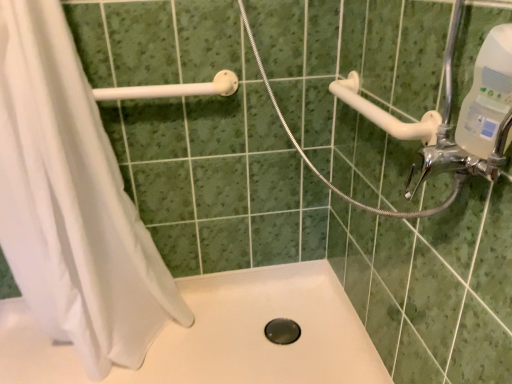
Question: Would you say white fabric shower curtain at left is outside white matte bath at center?

Choices:
 (A) no
 (B) yes

Answer: (B)

Question: Is white fabric shower curtain at left bigger than white matte bath at center?

Choices:
 (A) no
 (B) yes

Answer: (B)

Question: Can you confirm if white fabric shower curtain at left is positioned to the left of white matte bath at center?

Choices:
 (A) no
 (B) yes

Answer: (B)

Question: Is white matte bath at center inside white fabric shower curtain at left?

Choices:
 (A) no
 (B) yes

Answer: (A)

Question: Is white fabric shower curtain at left positioned with its back to white matte bath at center?

Choices:
 (A) no
 (B) yes

Answer: (A)

Question: In terms of width, does black rubber hole at center look wider or thinner when compared to chrome metallic faucet at upper right?

Choices:
 (A) wide
 (B) thin

Answer: (A)

Question: Is black rubber hole at center situated inside chrome metallic faucet at upper right or outside?

Choices:
 (A) inside
 (B) outside

Answer: (B)

Question: Relative to chrome metallic faucet at upper right, is black rubber hole at center in front or behind?

Choices:
 (A) front
 (B) behind

Answer: (B)

Question: Considering the positions of black rubber hole at center and chrome metallic faucet at upper right in the image, is black rubber hole at center bigger or smaller than chrome metallic faucet at upper right?

Choices:
 (A) big
 (B) small

Answer: (B)

Question: Considering the positions of white plastic grab bar at upper right, the 2th shower positioned from the left, and white plastic grab bar at upper left, which is the second shower from right to left, in the image, is white plastic grab bar at upper right, the 2th shower positioned from the left, wider or thinner than white plastic grab bar at upper left, which is the second shower from right to left,?

Choices:
 (A) wide
 (B) thin

Answer: (B)

Question: Relative to white plastic grab bar at upper left, the first shower in the left-to-right sequence, is white plastic grab bar at upper right, which ranks as the first shower in right-to-left order, in front or behind?

Choices:
 (A) behind
 (B) front

Answer: (B)

Question: Is white plastic grab bar at upper right, which ranks as the first shower in right-to-left order, bigger or smaller than white plastic grab bar at upper left, the first shower in the left-to-right sequence?

Choices:
 (A) small
 (B) big

Answer: (B)

Question: From the image's perspective, is white plastic grab bar at upper right, which ranks as the first shower in right-to-left order, positioned above or below white plastic grab bar at upper left, the first shower in the left-to-right sequence?

Choices:
 (A) above
 (B) below

Answer: (B)

Question: Choose the correct answer: Is white plastic grab bar at upper left, which is the second shower from right to left, inside white fabric shower curtain at left or outside it?

Choices:
 (A) outside
 (B) inside

Answer: (B)

Question: Is white plastic grab bar at upper left, the first shower in the left-to-right sequence, bigger or smaller than white fabric shower curtain at left?

Choices:
 (A) small
 (B) big

Answer: (A)